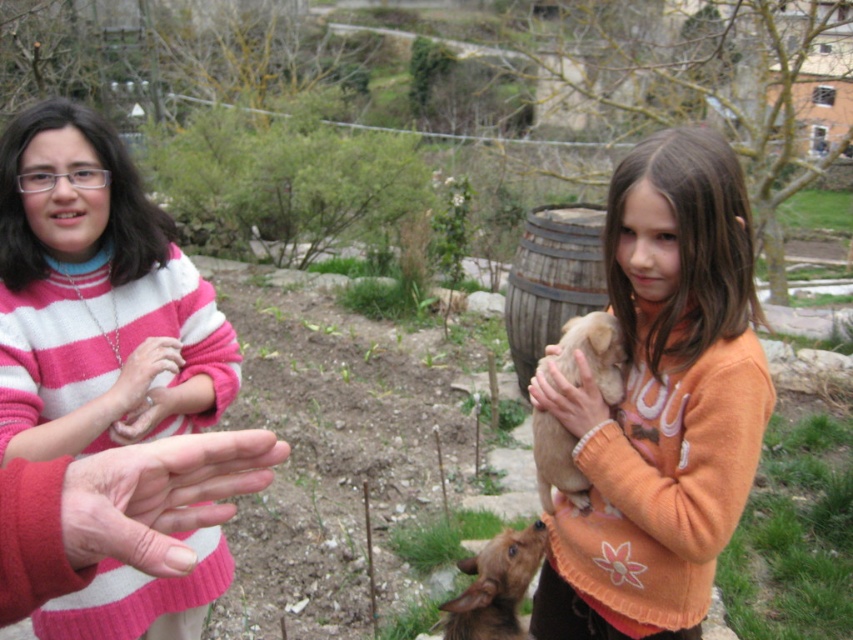
You are a photographer setting up a shoot in this garden scene. You need to place a small prop between the orange fleece sweater at center and the matte pink sweater at left. Based on their positions, which sweater should the prop be placed closer to?

The orange fleece sweater at center is positioned under the matte pink sweater at left, so the prop should be placed closer to the orange fleece sweater at center since it is lower in position.

You are a photographer trying to capture a candid shot of the pink matte hand at center and the matte pink sweater at left. Since you want to focus on the hand, which object should you adjust your camera focus to prioritize?

The pink matte hand at center is in front of the matte pink sweater at left, so you should focus on the pink matte hand at center to ensure it is the main subject in sharp focus.